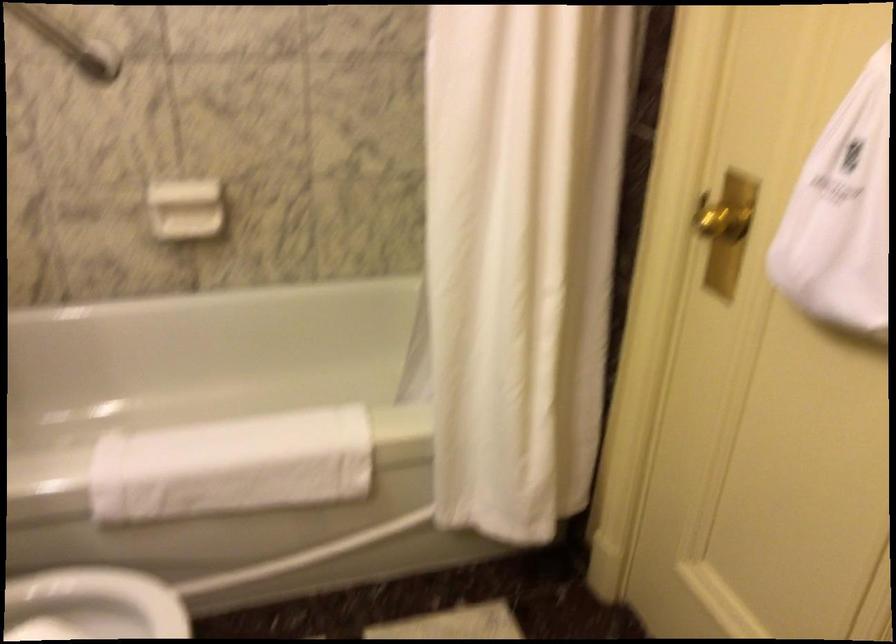
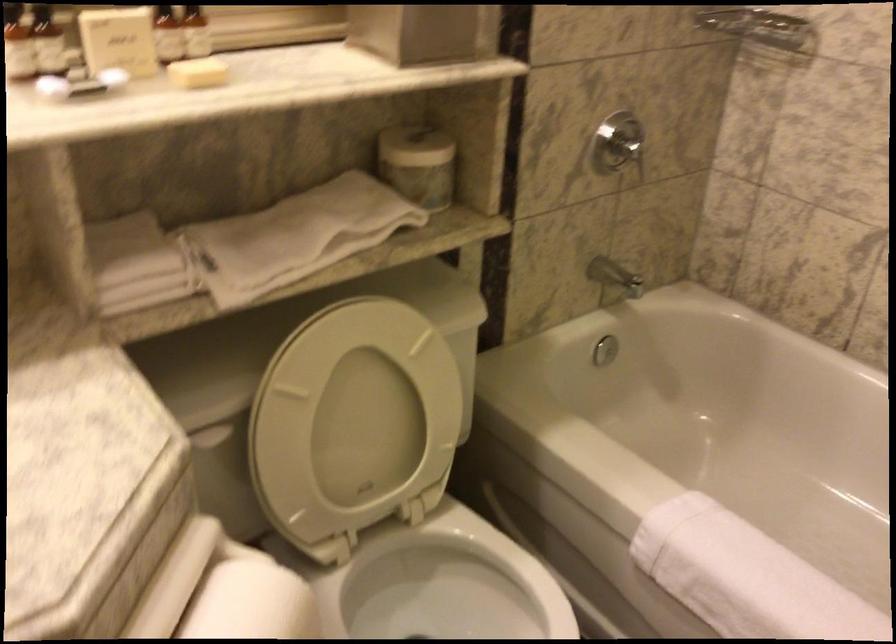
How did the camera likely rotate?

The rotation direction of the camera is left-down.